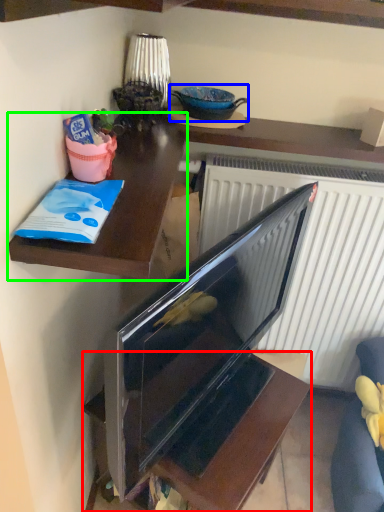
Question: Considering the real-world distances, which object is farthest from furniture (highlighted by a red box)? appliance (highlighted by a blue box) or desk (highlighted by a green box)?

Choices:
 (A) appliance
 (B) desk

Answer: (A)